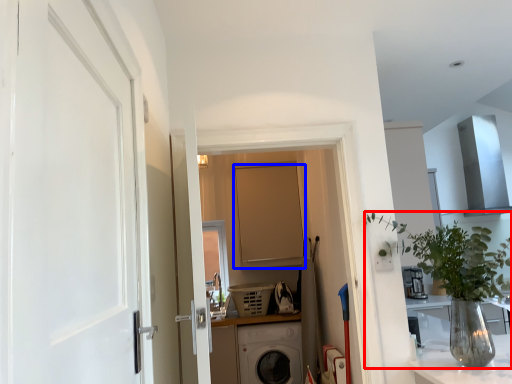
Question: Which point is closer to the camera, houseplant (highlighted by a red box) or door (highlighted by a blue box)?

Choices:
 (A) houseplant
 (B) door

Answer: (A)